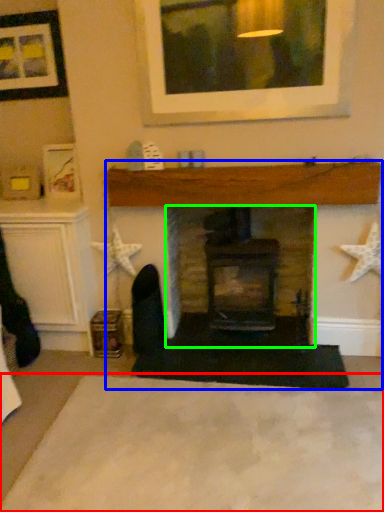
Question: Which object is the closest to the plain (highlighted by a red box)? Choose among these: fireplace (highlighted by a blue box) or fireplace (highlighted by a green box).

Choices:
 (A) fireplace
 (B) fireplace

Answer: (A)